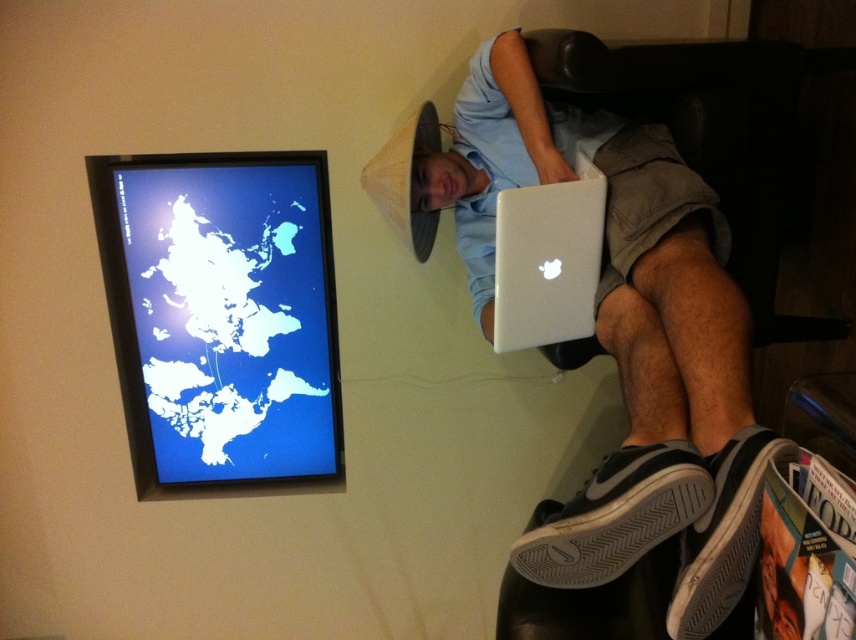
Question: Which point is closer to the camera?

Choices:
 (A) (693, 458)
 (B) (518, 125)
 (C) (712, 593)
 (D) (295, 164)

Answer: (C)

Question: Is silver metallic laptop at upper center above white rubber shoe at lower right?

Choices:
 (A) yes
 (B) no

Answer: (A)

Question: Which object appears farthest from the camera in this image?

Choices:
 (A) blue glossy map at upper left
 (B) black mesh shoe at lower right

Answer: (A)

Question: Can you confirm if blue glossy map at upper left is bigger than white rubber shoe at lower right?

Choices:
 (A) no
 (B) yes

Answer: (B)

Question: Estimate the real-world distances between objects in this image. Which object is farther from the black mesh shoe at lower right?

Choices:
 (A) silver metallic laptop at upper center
 (B) silver metallic laptop at center
 (C) blue glossy map at upper left

Answer: (C)

Question: Is black mesh shoe at lower right bigger than silver metallic laptop at center?

Choices:
 (A) yes
 (B) no

Answer: (B)